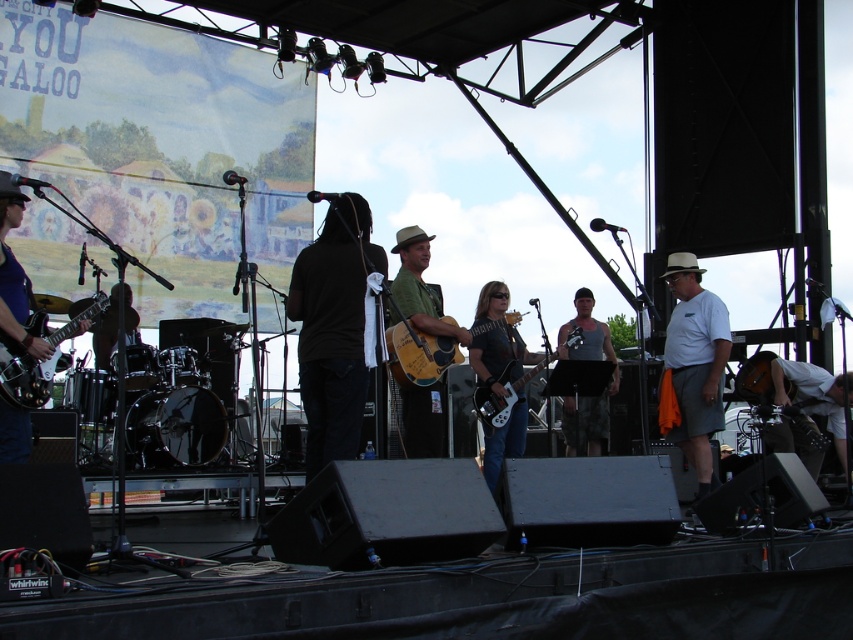
Question: Can you confirm if white cotton shirt at center is positioned below green matte guitar at center?

Choices:
 (A) yes
 (B) no

Answer: (A)

Question: Can you confirm if matte black guitar at center is positioned to the left of matte black electric guitar at center?

Choices:
 (A) yes
 (B) no

Answer: (A)

Question: Which of the following is the farthest from the observer?

Choices:
 (A) (502, 304)
 (B) (750, 371)
 (C) (367, 385)

Answer: (B)

Question: Where is black matte shirt at center located in relation to matte black electric guitar at left in the image?

Choices:
 (A) right
 (B) left

Answer: (A)

Question: Which object is the closest to the tank top at center?

Choices:
 (A) white cotton shirt at center
 (B) acoustic wood guitar at center
 (C) black matte shirt at center

Answer: (A)

Question: Estimate the real-world distances between objects in this image. Which object is farther from the matte black electric guitar at center?

Choices:
 (A) tank top at center
 (B) matte black guitar at center

Answer: (A)